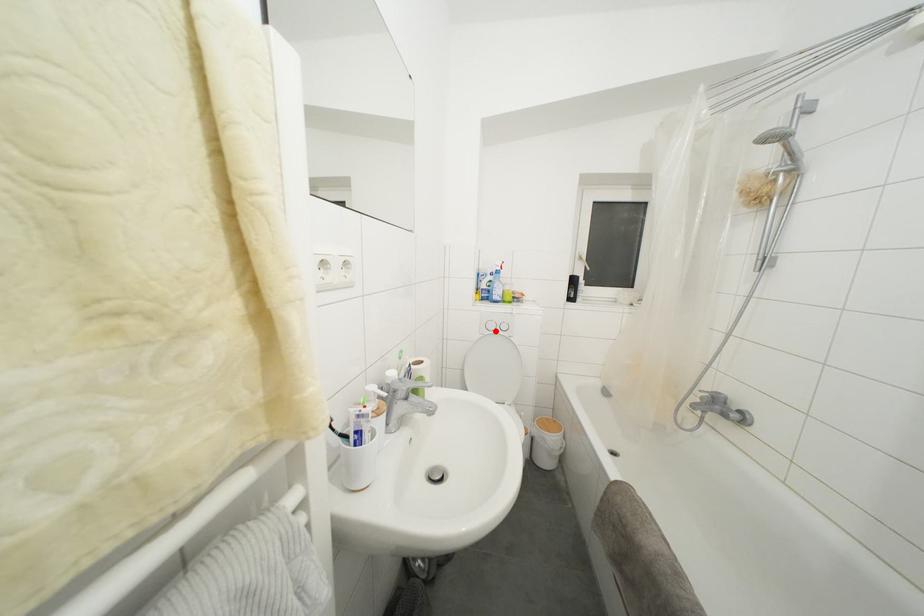
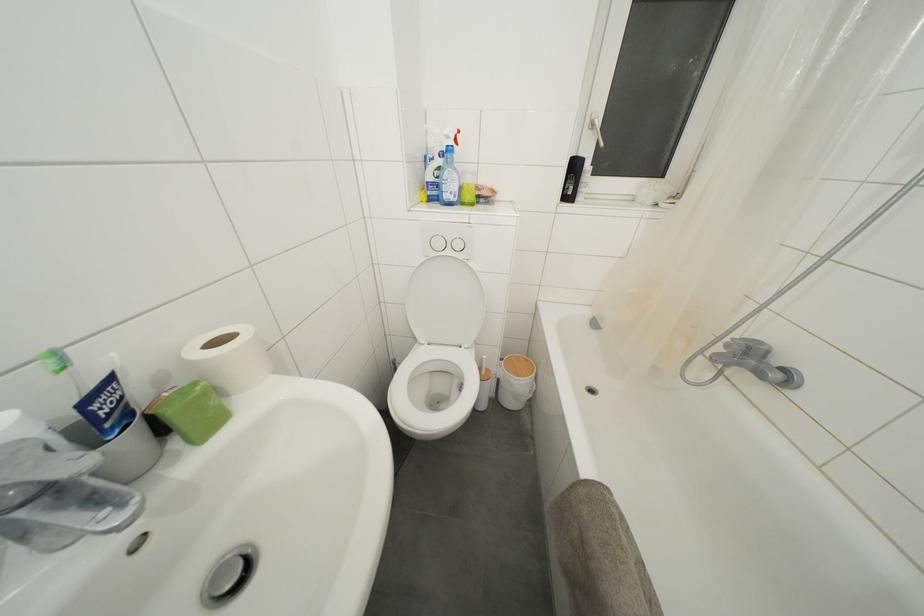
Find the pixel in the second image that matches the highlighted location in the first image.

(443, 249)